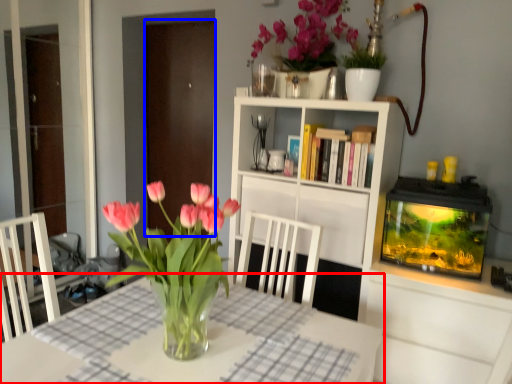
Question: Which object appears farthest to the camera in this image, table (highlighted by a red box) or glass door (highlighted by a blue box)?

Choices:
 (A) table
 (B) glass door

Answer: (B)